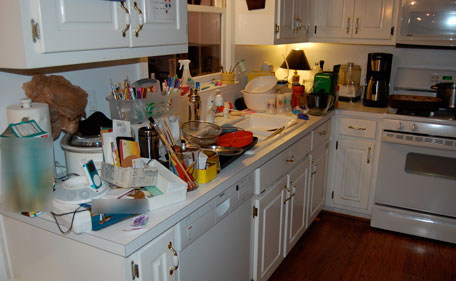
At what (x,y) coordinates should I click in order to perform the action: click on cluttered kitchen counter. Please return your answer as a coordinate pair (x, y). This screenshot has height=281, width=456. Looking at the image, I should click on (136, 163), (328, 97).